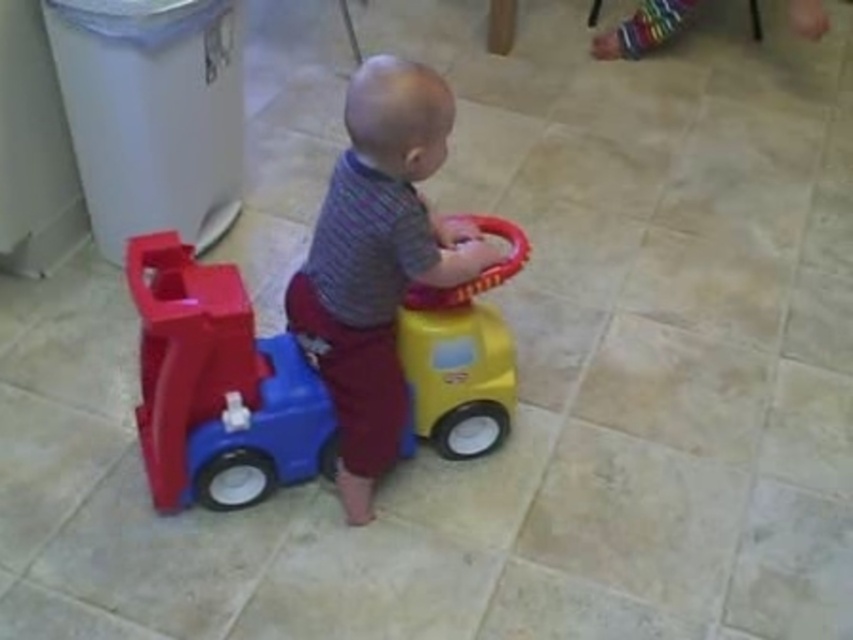
Question: Can you confirm if matte plastic car at center is positioned to the left of matte plastic toy car at center?

Choices:
 (A) no
 (B) yes

Answer: (B)

Question: Among these points, which one is nearest to the camera?

Choices:
 (A) (410, 147)
 (B) (498, 365)

Answer: (A)

Question: Does matte plastic car at center appear under matte plastic toy car at center?

Choices:
 (A) yes
 (B) no

Answer: (A)

Question: Which point is closer to the camera?

Choices:
 (A) matte plastic car at center
 (B) matte plastic toy car at center

Answer: (B)

Question: Is matte plastic car at center below matte plastic toy car at center?

Choices:
 (A) yes
 (B) no

Answer: (A)